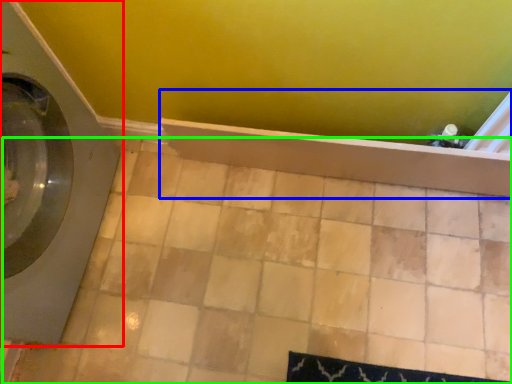
Question: Which object is positioned closest to washing machine (highlighted by a red box)? Select from bath (highlighted by a blue box) and ceramic tile (highlighted by a green box).

Choices:
 (A) bath
 (B) ceramic tile

Answer: (B)